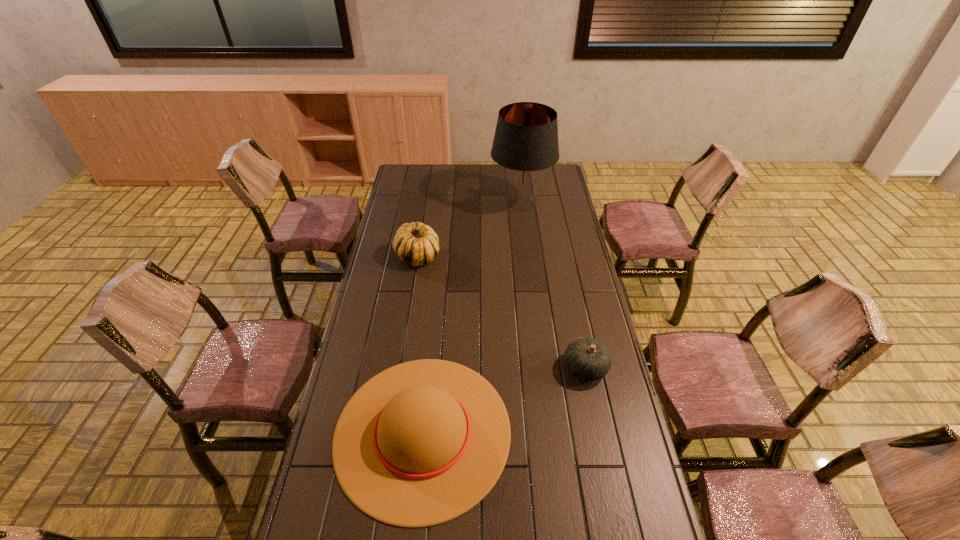
This screenshot has width=960, height=540. I want to click on free space between the lampshade and the taller gourd, so click(x=469, y=231).

Where is `empty space that is in between the shorter gourd and the sombrero`? empty space that is in between the shorter gourd and the sombrero is located at coordinates (504, 400).

Where is `unoccupied area between the sombrero and the farther gourd`? unoccupied area between the sombrero and the farther gourd is located at coordinates (420, 344).

The width and height of the screenshot is (960, 540). I want to click on free space between the shorter gourd and the left gourd, so click(x=501, y=312).

Find the location of `free space between the sombrero and the farthest object`. free space between the sombrero and the farthest object is located at coordinates (472, 318).

The height and width of the screenshot is (540, 960). Identify the location of vacant point located between the sombrero and the right gourd. (504, 400).

Where is `vacant region between the nearer gourd and the farthest object`? The image size is (960, 540). vacant region between the nearer gourd and the farthest object is located at coordinates (553, 286).

I want to click on vacant space in between the nearer gourd and the lampshade, so coord(553,286).

Locate an element on the screen. The width and height of the screenshot is (960, 540). blank region between the lampshade and the left gourd is located at coordinates (469, 231).

Locate which object ranks second in proximity to the right gourd. Please provide its 2D coordinates. Your answer should be formatted as a tuple, i.e. [(x, y)], where the tuple contains the x and y coordinates of a point satisfying the conditions above.

[(416, 244)]